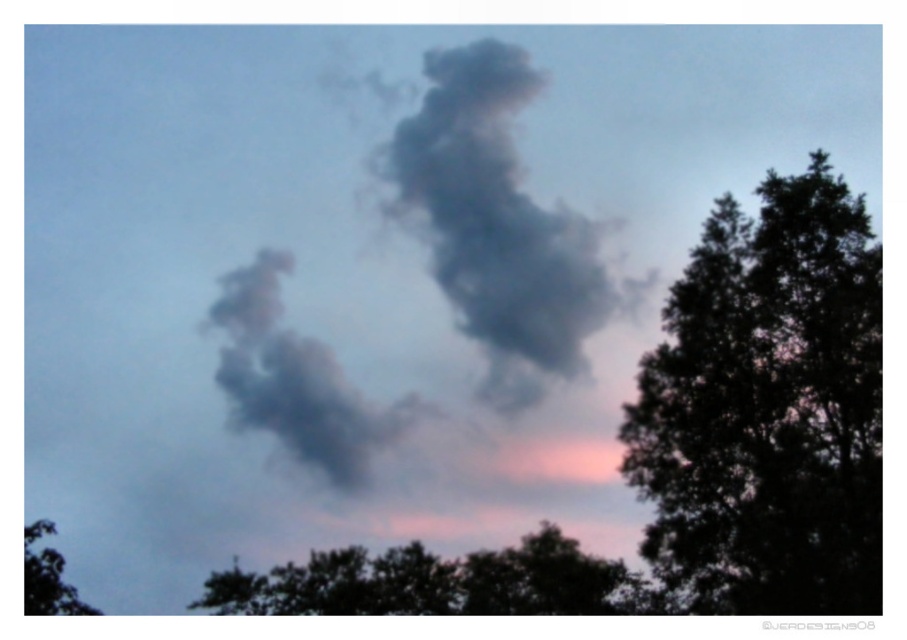
You are an observer standing in front of the scene. You see the dark green leafy tree at right and the green leafy tree at lower left. Which tree is closer to you?

The dark green leafy tree at right is positioned over the green leafy tree at lower left, which means it is closer to you.

You are an environmental scientist analyzing the image. You notice the dark green leafy tree at right and the gray matte cloud at center. Which object occupies a larger area in the image?

The dark green leafy tree at right is bigger than the gray matte cloud at center, so the dark green leafy tree at right occupies a larger area in the image.